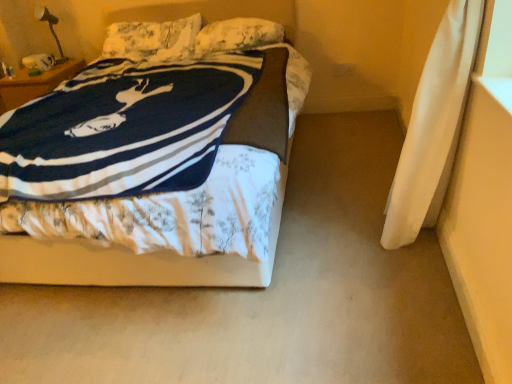
Question: Which direction should I rotate to look at fluffy white pillow at upper center, the 1th pillow when ordered from right to left, — up or down?

Choices:
 (A) down
 (B) up

Answer: (B)

Question: From a real-world perspective, is white floral fabric bed at center below fluffy white pillow at upper center, arranged as the 2th pillow when viewed from the right?

Choices:
 (A) no
 (B) yes

Answer: (B)

Question: Can you confirm if white floral fabric bed at center is thinner than fluffy white pillow at upper center, arranged as the first pillow when viewed from the left?

Choices:
 (A) no
 (B) yes

Answer: (A)

Question: Does white floral fabric bed at center have a larger size compared to fluffy white pillow at upper center, arranged as the first pillow when viewed from the left?

Choices:
 (A) no
 (B) yes

Answer: (B)

Question: Is white floral fabric bed at center next to fluffy white pillow at upper center, arranged as the first pillow when viewed from the left, and touching it?

Choices:
 (A) no
 (B) yes

Answer: (A)

Question: Is white floral fabric bed at center oriented away from fluffy white pillow at upper center, arranged as the first pillow when viewed from the left?

Choices:
 (A) no
 (B) yes

Answer: (B)

Question: Is white floral fabric bed at center further to camera compared to fluffy white pillow at upper center, arranged as the first pillow when viewed from the left?

Choices:
 (A) no
 (B) yes

Answer: (A)

Question: Considering the relative positions of fluffy white pillow at upper center, which is the second pillow from left to right, and fluffy white pillow at upper center, arranged as the 2th pillow when viewed from the right, in the image provided, is fluffy white pillow at upper center, which is the second pillow from left to right, in front of fluffy white pillow at upper center, arranged as the 2th pillow when viewed from the right,?

Choices:
 (A) yes
 (B) no

Answer: (A)

Question: Is fluffy white pillow at upper center, which is the second pillow from left to right, looking in the opposite direction of fluffy white pillow at upper center, arranged as the 2th pillow when viewed from the right?

Choices:
 (A) no
 (B) yes

Answer: (A)

Question: Is fluffy white pillow at upper center, which is the second pillow from left to right, beside fluffy white pillow at upper center, arranged as the 2th pillow when viewed from the right?

Choices:
 (A) no
 (B) yes

Answer: (A)

Question: Can you confirm if fluffy white pillow at upper center, the 1th pillow when ordered from right to left, is wider than fluffy white pillow at upper center, arranged as the first pillow when viewed from the left?

Choices:
 (A) no
 (B) yes

Answer: (A)

Question: Is fluffy white pillow at upper center, the 1th pillow when ordered from right to left, at the right side of fluffy white pillow at upper center, arranged as the first pillow when viewed from the left?

Choices:
 (A) yes
 (B) no

Answer: (A)

Question: Is fluffy white pillow at upper center, which is the second pillow from left to right, thinner than fluffy white pillow at upper center, arranged as the first pillow when viewed from the left?

Choices:
 (A) yes
 (B) no

Answer: (A)

Question: Does fluffy white pillow at upper center, arranged as the first pillow when viewed from the left, come behind white floral fabric bed at center?

Choices:
 (A) yes
 (B) no

Answer: (A)